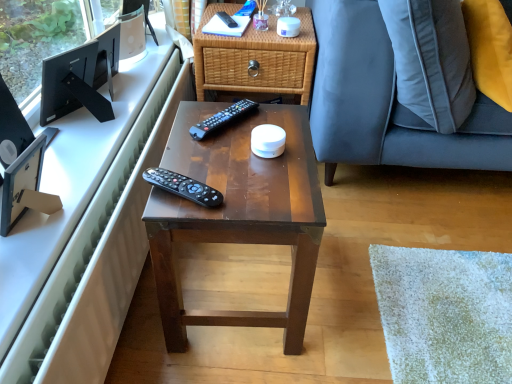
The height and width of the screenshot is (384, 512). Identify the location of black matte monitor at upper left, marked as the first television in a back-to-front arrangement. (80, 78).

Describe the element at coordinates (88, 232) in the screenshot. The height and width of the screenshot is (384, 512). I see `white glossy computer desk at upper left` at that location.

What is the approximate height of black plastic remote control at center, the 1th remote control in the bottom-to-top sequence?

3.11 centimeters.

Image resolution: width=512 pixels, height=384 pixels. Find the location of `black plastic remote control at center, which appears as the second remote control when viewed from the front`. black plastic remote control at center, which appears as the second remote control when viewed from the front is located at coordinates (222, 118).

Locate an element on the screen. This screenshot has height=384, width=512. black plastic picture frame at left, marked as the second television in a back-to-front arrangement is located at coordinates (25, 187).

Image resolution: width=512 pixels, height=384 pixels. Describe the element at coordinates (25, 187) in the screenshot. I see `black plastic picture frame at left, the 2th television in the top-to-bottom sequence` at that location.

Find the location of a particular element. This screenshot has width=512, height=384. black matte monitor at upper left, which is the 1th television in top-to-bottom order is located at coordinates (80, 78).

Can we say black plastic remote control at center, the 3th remote control from the back, lies outside black plastic remote control at upper center, which appears as the 3th remote control when viewed from the front?

Yes, black plastic remote control at center, the 3th remote control from the back, is located beyond the bounds of black plastic remote control at upper center, which appears as the 3th remote control when viewed from the front.

Which object is positioned more to the right, black plastic remote control at center, the 1th remote control in the bottom-to-top sequence, or black plastic remote control at upper center, which ranks as the 3th remote control in bottom-to-top order?

black plastic remote control at upper center, which ranks as the 3th remote control in bottom-to-top order, is more to the right.

Considering the sizes of objects black plastic remote control at center, marked as the third remote control in a top-to-bottom arrangement, and black plastic remote control at upper center, which ranks as the 3th remote control in bottom-to-top order, in the image provided, who is wider, black plastic remote control at center, marked as the third remote control in a top-to-bottom arrangement, or black plastic remote control at upper center, which ranks as the 3th remote control in bottom-to-top order,?

Wider between the two is black plastic remote control at center, marked as the third remote control in a top-to-bottom arrangement.

Is black plastic picture frame at left, which ranks as the first television in front-to-back order, further to camera compared to black plastic remote control at center, marked as the third remote control in a top-to-bottom arrangement?

No, black plastic picture frame at left, which ranks as the first television in front-to-back order, is closer to the viewer.

From a real-world perspective, between black plastic picture frame at left, which ranks as the first television in front-to-back order, and black plastic remote control at center, marked as the third remote control in a top-to-bottom arrangement, who is vertically higher?

From a 3D spatial view, black plastic remote control at center, marked as the third remote control in a top-to-bottom arrangement, is above.

Is black plastic picture frame at left, the 2th television in the top-to-bottom sequence, smaller than black plastic remote control at center, the 3th remote control from the back?

No.

Image resolution: width=512 pixels, height=384 pixels. What are the coordinates of `television in front of the black plastic remote control at center, which is the first remote control in front-to-back order` in the screenshot? It's located at (25, 187).

Is point (30, 159) closer to camera compared to point (223, 313)?

Yes, point (30, 159) is in front of point (223, 313).

Between black plastic picture frame at left, which is the 1th television in bottom-to-top order, and brown polished wood desk at center, which one has larger size?

With larger size is brown polished wood desk at center.

In the image, is black plastic picture frame at left, which is the 1th television in bottom-to-top order, positioned in front of or behind brown polished wood desk at center?

Visually, black plastic picture frame at left, which is the 1th television in bottom-to-top order, is located in front of brown polished wood desk at center.

From the image's perspective, which is below, black plastic picture frame at left, which ranks as the first television in front-to-back order, or brown polished wood desk at center?

brown polished wood desk at center.

Is black plastic remote control at center, placed as the second remote control when sorted from bottom to top, aimed at black plastic picture frame at left, the 2th television in the top-to-bottom sequence?

No, black plastic remote control at center, placed as the second remote control when sorted from bottom to top, is not oriented towards black plastic picture frame at left, the 2th television in the top-to-bottom sequence.

Is black plastic remote control at center, which ranks as the second remote control in top-to-bottom order, positioned behind black plastic picture frame at left, which ranks as the first television in front-to-back order?

Yes, black plastic remote control at center, which ranks as the second remote control in top-to-bottom order, is behind black plastic picture frame at left, which ranks as the first television in front-to-back order.

In terms of width, does black plastic remote control at center, which appears as the second remote control when viewed from the back, look wider or thinner when compared to black plastic picture frame at left, the 2th television in the top-to-bottom sequence?

In the image, black plastic remote control at center, which appears as the second remote control when viewed from the back, appears to be more narrow than black plastic picture frame at left, the 2th television in the top-to-bottom sequence.

Can you confirm if black plastic remote control at center, which appears as the second remote control when viewed from the front, is shorter than black plastic picture frame at left, which is the 1th television in bottom-to-top order?

Yes.

Considering the relative sizes of woven wood nightstand at upper center and brown polished wood desk at center in the image provided, is woven wood nightstand at upper center bigger than brown polished wood desk at center?

No, woven wood nightstand at upper center is not bigger than brown polished wood desk at center.

Are woven wood nightstand at upper center and brown polished wood desk at center making contact?

woven wood nightstand at upper center is not next to brown polished wood desk at center, and they're not touching.

How different are the orientations of woven wood nightstand at upper center and brown polished wood desk at center in degrees?

91.3 degrees.

Which of these two, woven wood nightstand at upper center or brown polished wood desk at center, is thinner?

brown polished wood desk at center is thinner.

How many degrees apart are the facing directions of brown polished wood desk at center and black plastic remote control at center, the 3th remote control from the back?

The facing directions of brown polished wood desk at center and black plastic remote control at center, the 3th remote control from the back, are 24.3 degrees apart.

From the image's perspective, is brown polished wood desk at center on black plastic remote control at center, the 1th remote control in the bottom-to-top sequence?

Incorrect, from the image's perspective, brown polished wood desk at center is lower than black plastic remote control at center, the 1th remote control in the bottom-to-top sequence.

Which of these two, brown polished wood desk at center or black plastic remote control at center, the 1th remote control in the bottom-to-top sequence, stands taller?

brown polished wood desk at center is taller.

Considering the relative sizes of brown polished wood desk at center and black plastic remote control at center, the 3th remote control from the back, in the image provided, is brown polished wood desk at center thinner than black plastic remote control at center, the 3th remote control from the back,?

No.

Is brown polished wood desk at center taller than woven wood nightstand at upper center?

Correct, brown polished wood desk at center is much taller as woven wood nightstand at upper center.

Is woven wood nightstand at upper center located within brown polished wood desk at center?

That's incorrect, woven wood nightstand at upper center is not inside brown polished wood desk at center.

Is brown polished wood desk at center facing away from woven wood nightstand at upper center?

No, woven wood nightstand at upper center is not at the back of brown polished wood desk at center.

Are brown polished wood desk at center and woven wood nightstand at upper center beside each other?

brown polished wood desk at center is not next to woven wood nightstand at upper center, and they're not touching.

From the image's perspective, which remote control is the 2nd one above the black plastic remote control at center, the 3th remote control from the back? Please provide its 2D coordinates.

[(227, 19)]

I want to click on television in front of the black plastic remote control at center, the 3th remote control from the back, so pyautogui.click(x=25, y=187).

Based on their spatial positions, is black plastic remote control at center, the 1th remote control in the bottom-to-top sequence, or white glossy computer desk at upper left further from black plastic remote control at center, placed as the second remote control when sorted from bottom to top?

Based on the image, white glossy computer desk at upper left appears to be further to black plastic remote control at center, placed as the second remote control when sorted from bottom to top.

Which object lies nearer to the anchor point white glossy computer desk at upper left, black matte monitor at upper left, the second television when ordered from bottom to top, or black plastic remote control at upper center, which is counted as the 1th remote control, starting from the top?

black matte monitor at upper left, the second television when ordered from bottom to top, is positioned closer to the anchor white glossy computer desk at upper left.

When comparing their distances from black plastic picture frame at left, which ranks as the first television in front-to-back order, does black plastic remote control at upper center, which is the first remote control in back-to-front order, or black matte monitor at upper left, which is the 1th television in top-to-bottom order, seem closer?

Based on the image, black matte monitor at upper left, which is the 1th television in top-to-bottom order, appears to be nearer to black plastic picture frame at left, which ranks as the first television in front-to-back order.

Which object lies nearer to the anchor point white glossy computer desk at upper left, black plastic picture frame at left, marked as the second television in a back-to-front arrangement, or black matte monitor at upper left, marked as the first television in a back-to-front arrangement?

black plastic picture frame at left, marked as the second television in a back-to-front arrangement, is closer to white glossy computer desk at upper left.

When comparing their distances from black plastic remote control at center, which is the first remote control in front-to-back order, does brown polished wood desk at center or black plastic picture frame at left, which ranks as the first television in front-to-back order, seem closer?

brown polished wood desk at center is positioned closer to the anchor black plastic remote control at center, which is the first remote control in front-to-back order.

Estimate the real-world distances between objects in this image. Which object is closer to white glossy computer desk at upper left, black plastic remote control at upper center, which appears as the 3th remote control when viewed from the front, or black matte monitor at upper left, placed as the second television when sorted from front to back?

The object closer to white glossy computer desk at upper left is black matte monitor at upper left, placed as the second television when sorted from front to back.

Estimate the real-world distances between objects in this image. Which object is further from black plastic remote control at center, the 3th remote control from the back, white glossy computer desk at upper left or black plastic remote control at upper center, which ranks as the 3th remote control in bottom-to-top order?

black plastic remote control at upper center, which ranks as the 3th remote control in bottom-to-top order, is further to black plastic remote control at center, the 3th remote control from the back.

Considering their positions, is black plastic remote control at center, the 1th remote control in the bottom-to-top sequence, positioned closer to black plastic picture frame at left, which is the 1th television in bottom-to-top order, than woven wood nightstand at upper center?

black plastic remote control at center, the 1th remote control in the bottom-to-top sequence, is positioned closer to the anchor black plastic picture frame at left, which is the 1th television in bottom-to-top order.

This screenshot has width=512, height=384. Identify the location of computer desk between black matte monitor at upper left, the second television when ordered from bottom to top, and brown polished wood desk at center, in the horizontal direction. (88, 232).

Locate an element on the screen. desk between black plastic picture frame at left, marked as the second television in a back-to-front arrangement, and woven wood nightstand at upper center from front to back is located at coordinates (238, 214).

You are a GUI agent. You are given a task and a screenshot of the screen. Output one action in this format:
    pyautogui.click(x=<x>, y=<y>)
    Task: Click on the nightstand between black plastic picture frame at left, the 2th television in the top-to-bottom sequence, and black plastic remote control at upper center, which is counted as the 1th remote control, starting from the top, in the front-back direction
    This screenshot has width=512, height=384.
    Given the screenshot: What is the action you would take?
    pyautogui.click(x=257, y=60)

I want to click on nightstand between black plastic remote control at center, marked as the third remote control in a top-to-bottom arrangement, and black plastic remote control at upper center, which is the first remote control in back-to-front order, along the z-axis, so click(x=257, y=60).